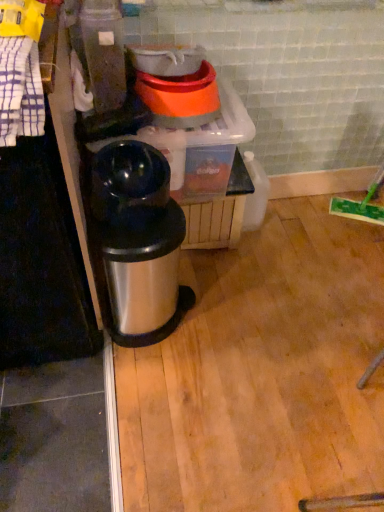
Question: Can you confirm if shiny metallic trash can at center is thinner than shiny black thermos at center, the second appliance in the top-to-bottom sequence?

Choices:
 (A) yes
 (B) no

Answer: (B)

Question: Does shiny metallic trash can at center have a greater width compared to shiny black thermos at center, the first appliance positioned from the bottom?

Choices:
 (A) no
 (B) yes

Answer: (B)

Question: Would you say shiny metallic trash can at center is a long distance from shiny black thermos at center, the first appliance positioned from the bottom?

Choices:
 (A) yes
 (B) no

Answer: (B)

Question: Does shiny metallic trash can at center turn towards shiny black thermos at center, the second appliance in the top-to-bottom sequence?

Choices:
 (A) no
 (B) yes

Answer: (A)

Question: Does shiny metallic trash can at center come behind shiny black thermos at center, the second appliance in the top-to-bottom sequence?

Choices:
 (A) yes
 (B) no

Answer: (A)

Question: In the image, is white checkered towel at left positioned in front of or behind shiny metallic trash can at center?

Choices:
 (A) front
 (B) behind

Answer: (A)

Question: Considering the positions of white checkered towel at left and shiny metallic trash can at center in the image, is white checkered towel at left bigger or smaller than shiny metallic trash can at center?

Choices:
 (A) small
 (B) big

Answer: (A)

Question: Is white checkered towel at left situated inside shiny metallic trash can at center or outside?

Choices:
 (A) inside
 (B) outside

Answer: (B)

Question: In the image, is white checkered towel at left on the left side or the right side of shiny metallic trash can at center?

Choices:
 (A) left
 (B) right

Answer: (A)

Question: Considering the positions of shiny metallic trash can at center and orange plastic bowls at upper center, which ranks as the 1th appliance in top-to-bottom order, in the image, is shiny metallic trash can at center wider or thinner than orange plastic bowls at upper center, which ranks as the 1th appliance in top-to-bottom order,?

Choices:
 (A) wide
 (B) thin

Answer: (B)

Question: Based on their sizes in the image, would you say shiny metallic trash can at center is bigger or smaller than orange plastic bowls at upper center, placed as the 2th appliance when sorted from bottom to top?

Choices:
 (A) big
 (B) small

Answer: (A)

Question: From the image's perspective, is shiny metallic trash can at center above or below orange plastic bowls at upper center, which ranks as the 1th appliance in top-to-bottom order?

Choices:
 (A) below
 (B) above

Answer: (A)

Question: Considering the positions of shiny metallic trash can at center and orange plastic bowls at upper center, placed as the 2th appliance when sorted from bottom to top, in the image, is shiny metallic trash can at center taller or shorter than orange plastic bowls at upper center, placed as the 2th appliance when sorted from bottom to top,?

Choices:
 (A) short
 (B) tall

Answer: (B)

Question: Is shiny black thermos at center, the first appliance positioned from the bottom, wider or thinner than shiny metallic trash can at center?

Choices:
 (A) thin
 (B) wide

Answer: (A)

Question: Considering the relative positions of shiny black thermos at center, the second appliance in the top-to-bottom sequence, and shiny metallic trash can at center in the image provided, is shiny black thermos at center, the second appliance in the top-to-bottom sequence, to the left or to the right of shiny metallic trash can at center?

Choices:
 (A) right
 (B) left

Answer: (B)